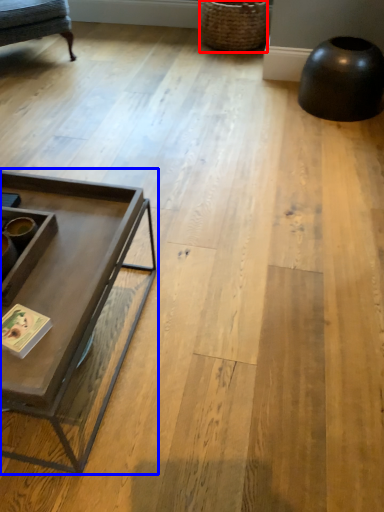
Question: Which object is further to the camera taking this photo, basket (highlighted by a red box) or coffee table (highlighted by a blue box)?

Choices:
 (A) basket
 (B) coffee table

Answer: (A)